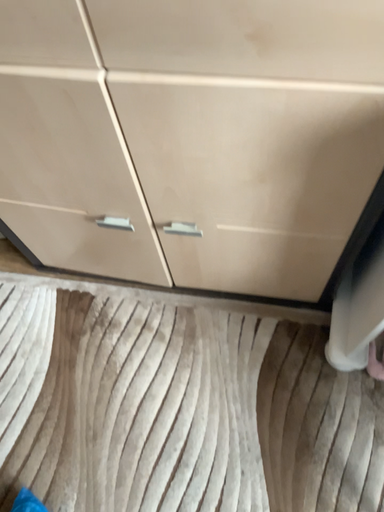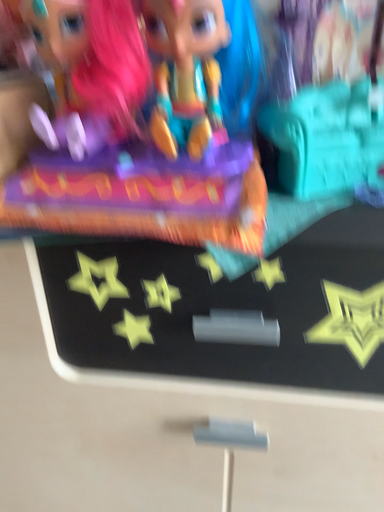
Question: How did the camera likely rotate when shooting the video?

Choices:
 (A) rotated left
 (B) rotated right

Answer: (B)